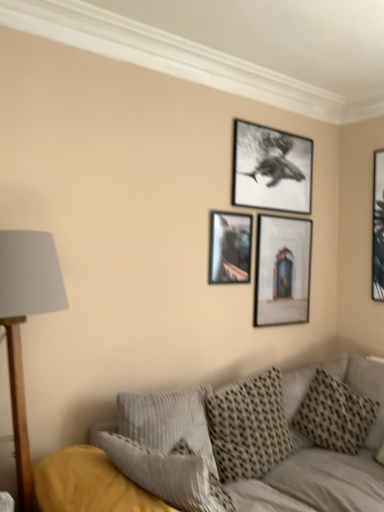
Question: Is patterned fabric pillow at center, arranged as the second pillow when viewed from the left, facing towards matte wooden picture frame at center, the third picture frame when ordered from left to right?

Choices:
 (A) yes
 (B) no

Answer: (B)

Question: Is patterned fabric pillow at center, arranged as the second pillow when viewed from the left, positioned with its back to matte wooden picture frame at center, which ranks as the 2th picture frame in right-to-left order?

Choices:
 (A) no
 (B) yes

Answer: (A)

Question: Is the depth of patterned fabric pillow at center, acting as the second pillow starting from the right, less than that of matte wooden picture frame at center, which ranks as the 2th picture frame in right-to-left order?

Choices:
 (A) no
 (B) yes

Answer: (B)

Question: Can you confirm if patterned fabric pillow at center, arranged as the second pillow when viewed from the left, is positioned to the right of matte wooden picture frame at center, the third picture frame when ordered from left to right?

Choices:
 (A) yes
 (B) no

Answer: (B)

Question: Is patterned fabric pillow at center, arranged as the second pillow when viewed from the left, outside of matte wooden picture frame at center, the third picture frame when ordered from left to right?

Choices:
 (A) no
 (B) yes

Answer: (B)

Question: From the image's perspective, is patterned fabric pillow at center, arranged as the second pillow when viewed from the left, on matte wooden picture frame at center, the third picture frame when ordered from left to right?

Choices:
 (A) yes
 (B) no

Answer: (B)

Question: Is wooden base with gray fabric lampshade at left aimed at matte black picture frame at right, the first picture frame positioned from the right?

Choices:
 (A) yes
 (B) no

Answer: (B)

Question: Is wooden base with gray fabric lampshade at left at the left side of matte black picture frame at right, the first picture frame positioned from the right?

Choices:
 (A) yes
 (B) no

Answer: (A)

Question: From the image's perspective, would you say wooden base with gray fabric lampshade at left is positioned over matte black picture frame at right, arranged as the 4th picture frame when viewed from the left?

Choices:
 (A) yes
 (B) no

Answer: (B)

Question: Does wooden base with gray fabric lampshade at left lie in front of matte black picture frame at right, the first picture frame positioned from the right?

Choices:
 (A) no
 (B) yes

Answer: (B)

Question: Is wooden base with gray fabric lampshade at left positioned with its back to matte black picture frame at right, the first picture frame positioned from the right?

Choices:
 (A) yes
 (B) no

Answer: (B)

Question: Considering the relative sizes of wooden base with gray fabric lampshade at left and matte black picture frame at right, the first picture frame positioned from the right, in the image provided, is wooden base with gray fabric lampshade at left smaller than matte black picture frame at right, the first picture frame positioned from the right,?

Choices:
 (A) yes
 (B) no

Answer: (B)

Question: From the image's perspective, is patterned fabric pillow at center, acting as the second pillow starting from the right, above black matte picture frame at upper center, the 3th picture frame in the right-to-left sequence?

Choices:
 (A) no
 (B) yes

Answer: (A)